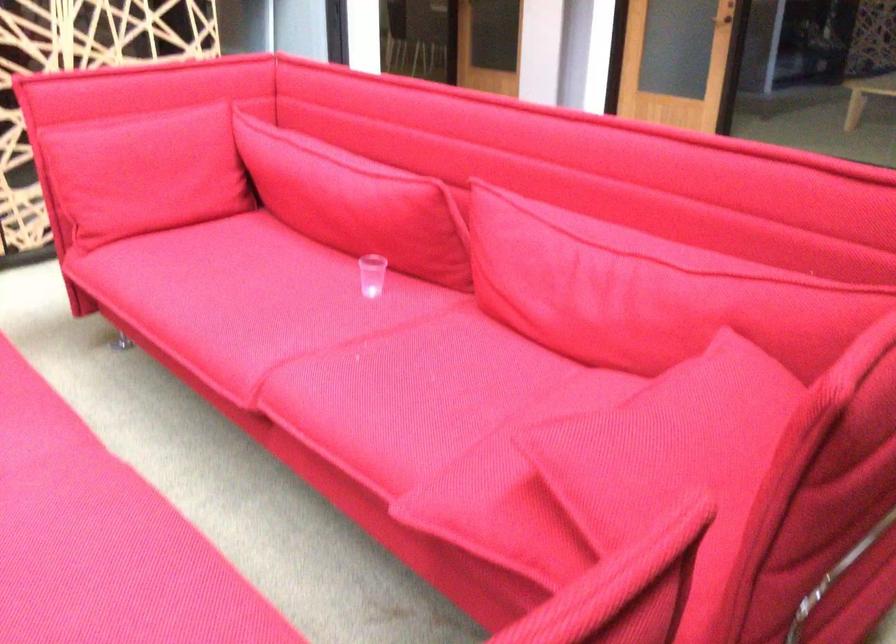
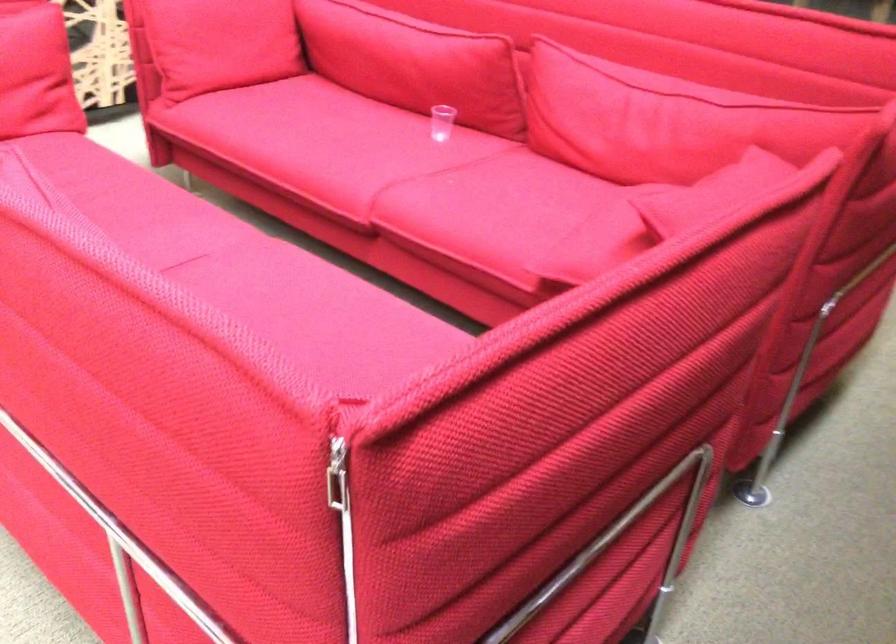
Where in the second image is the point corresponding to pixel 622 289 from the first image?

(664, 120)